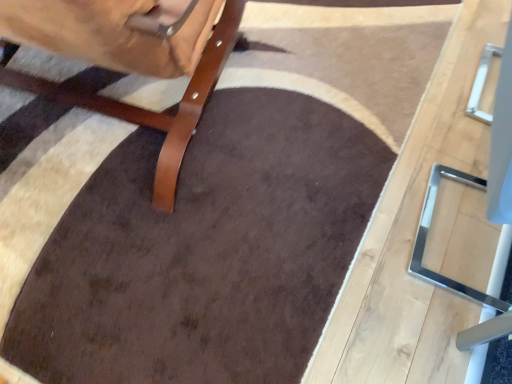
Question: From a real-world perspective, is metallic silver table at right positioned above or below brown leather chair at left?

Choices:
 (A) below
 (B) above

Answer: (A)

Question: From the image's perspective, is metallic silver table at right above or below brown leather chair at left?

Choices:
 (A) above
 (B) below

Answer: (B)

Question: Is metallic silver table at right taller or shorter than brown leather chair at left?

Choices:
 (A) short
 (B) tall

Answer: (B)

Question: From the image's perspective, is brown leather chair at left located above or below metallic silver table at right?

Choices:
 (A) below
 (B) above

Answer: (B)

Question: Considering the positions of brown leather chair at left and metallic silver table at right in the image, is brown leather chair at left wider or thinner than metallic silver table at right?

Choices:
 (A) thin
 (B) wide

Answer: (B)

Question: Choose the correct answer: Is brown leather chair at left inside metallic silver table at right or outside it?

Choices:
 (A) inside
 (B) outside

Answer: (B)

Question: Would you say brown leather chair at left is to the left or to the right of metallic silver table at right in the picture?

Choices:
 (A) right
 (B) left

Answer: (B)